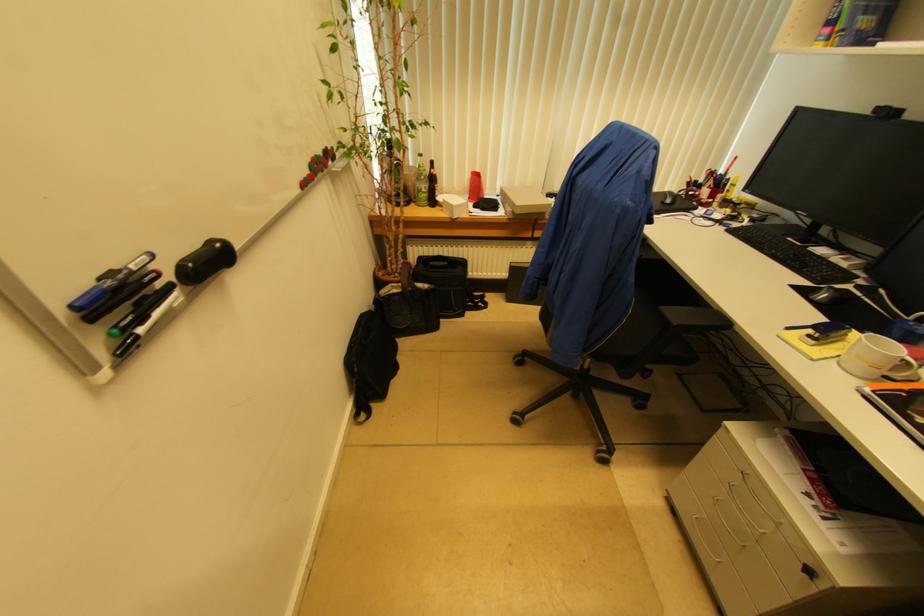
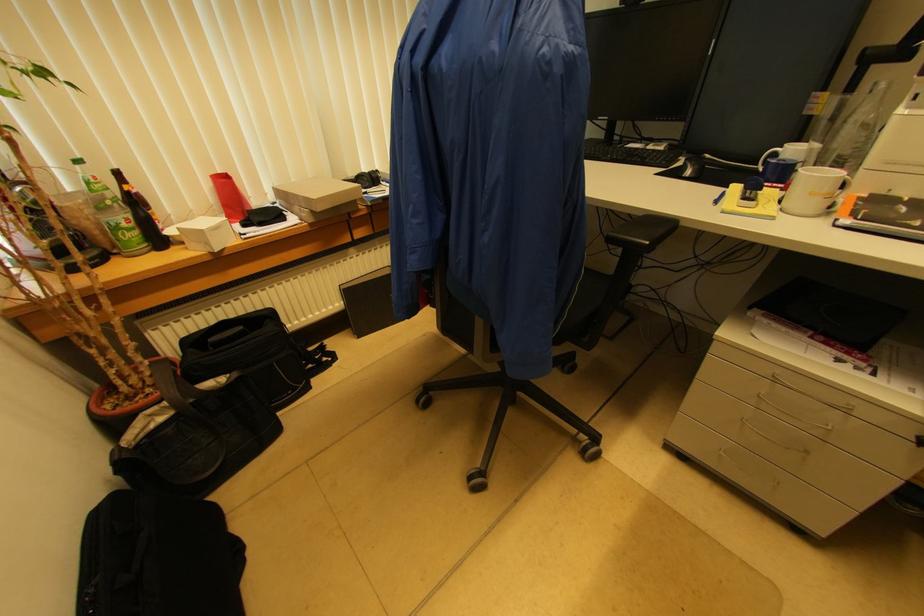
Find the pixel in the second image that matches pixel 676 326 in the first image.

(650, 245)